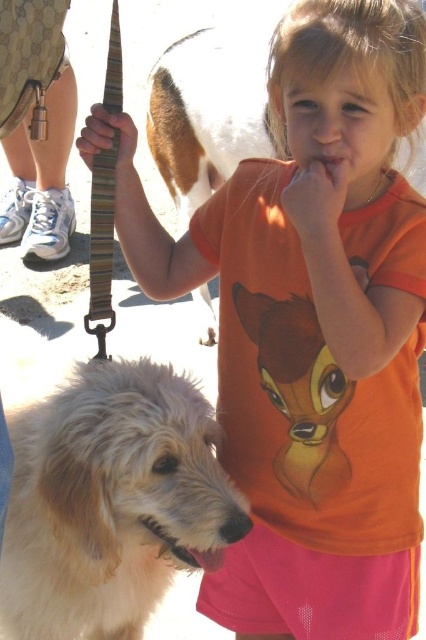
Can you confirm if white fluffy dog at center is bigger than white fur dog at center?

Incorrect, white fluffy dog at center is not larger than white fur dog at center.

Can you confirm if white fluffy dog at center is smaller than white fur dog at center?

Yes.

I want to click on white fluffy dog at center, so click(x=111, y=500).